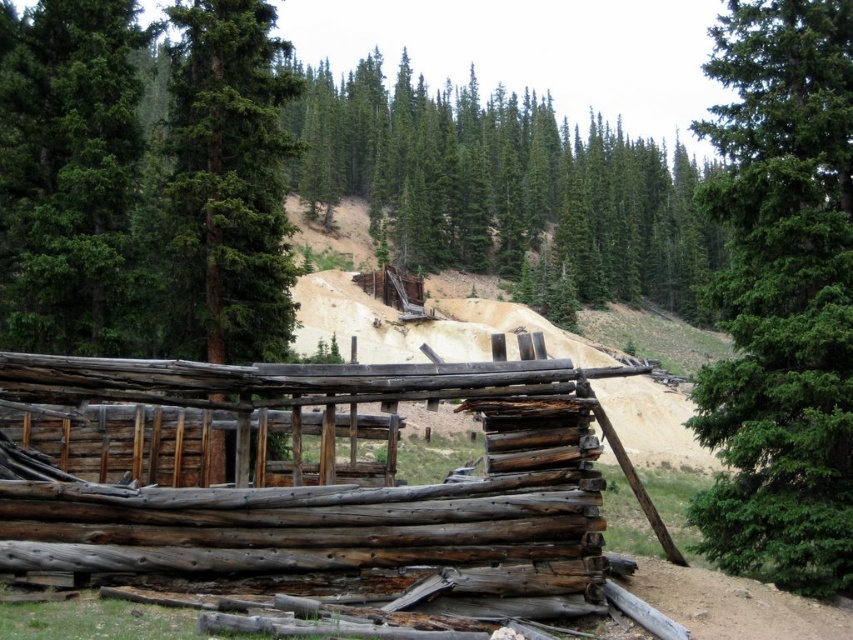
Question: Is green textured pine at upper right in front of green textured tree at left?

Choices:
 (A) no
 (B) yes

Answer: (B)

Question: Does green coniferous trees at upper center appear on the right side of green textured tree at left?

Choices:
 (A) yes
 (B) no

Answer: (A)

Question: Which object is positioned closest to the green textured pine at upper right?

Choices:
 (A) green coniferous trees at upper center
 (B) sandy brown dirt at upper center
 (C) green textured tree at left
 (D) brown dirt track at lower right

Answer: (D)

Question: Estimate the real-world distances between objects in this image. Which object is farther from the sandy brown dirt at upper center?

Choices:
 (A) green textured tree at left
 (B) green coniferous trees at upper center
 (C) green textured pine at upper right

Answer: (C)

Question: Which object is closer to the camera taking this photo?

Choices:
 (A) sandy brown dirt at upper center
 (B) green coniferous trees at upper center

Answer: (B)

Question: Is green textured pine at upper right behind green textured tree at left?

Choices:
 (A) no
 (B) yes

Answer: (A)